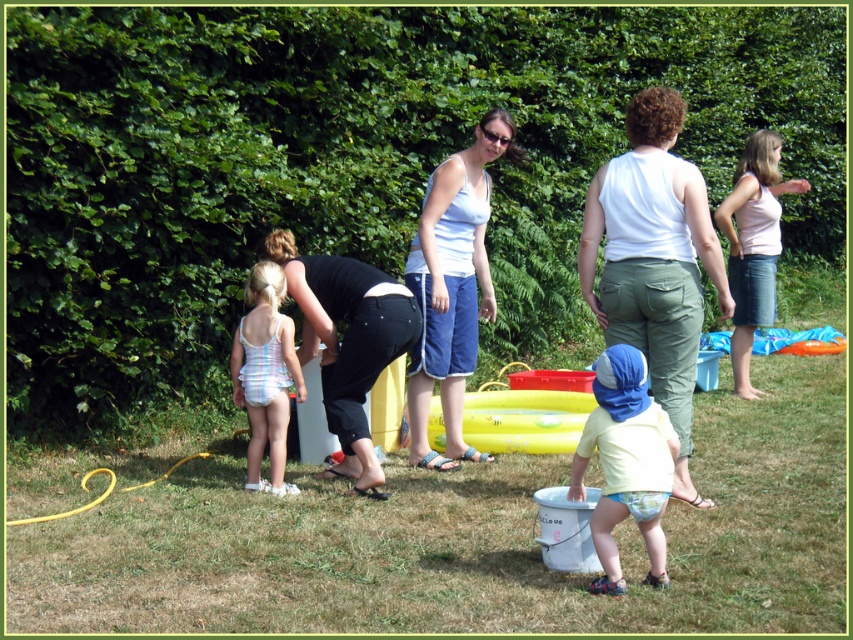
Does yellow cotton shirt at center appear over striped fabric swimsuit at center left?

Actually, yellow cotton shirt at center is below striped fabric swimsuit at center left.

Which is in front, point (625, 417) or point (274, 436)?

Point (625, 417) is in front.

Where is `yellow cotton shirt at center`? The height and width of the screenshot is (640, 853). yellow cotton shirt at center is located at coordinates click(x=625, y=464).

Between yellow cotton shirt at center and pink cotton tank top at upper right, which one has more height?

pink cotton tank top at upper right

Does yellow cotton shirt at center appear over pink cotton tank top at upper right?

Incorrect, yellow cotton shirt at center is not positioned above pink cotton tank top at upper right.

Does point (663, 554) lie behind point (752, 145)?

No, (663, 554) is closer to viewer.

Identify the location of yellow cotton shirt at center. The height and width of the screenshot is (640, 853). (625, 464).

In the scene shown: Is white striped tank top at center further to the viewer compared to pink cotton tank top at upper right?

No, white striped tank top at center is closer to the viewer.

Between point (480, 228) and point (776, 205), which one is positioned in front?

Positioned in front is point (480, 228).

Image resolution: width=853 pixels, height=640 pixels. In order to click on white striped tank top at center in this screenshot , I will do `click(451, 285)`.